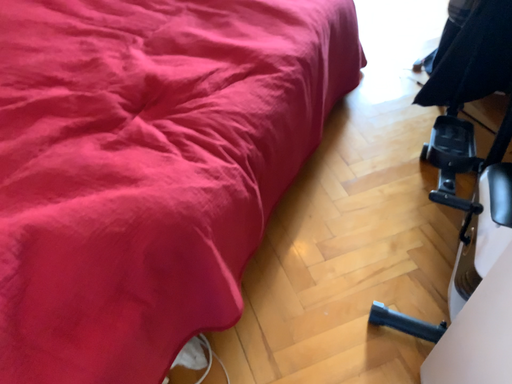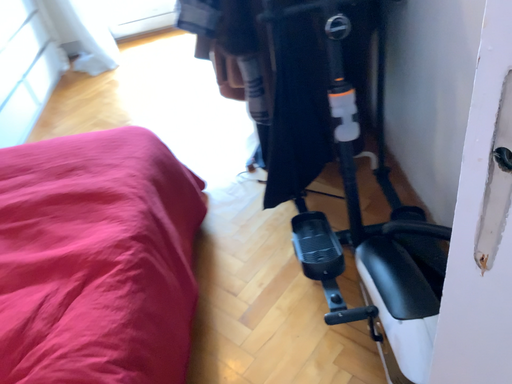
Question: Which way did the camera rotate in the video?

Choices:
 (A) rotated upward
 (B) rotated downward

Answer: (A)